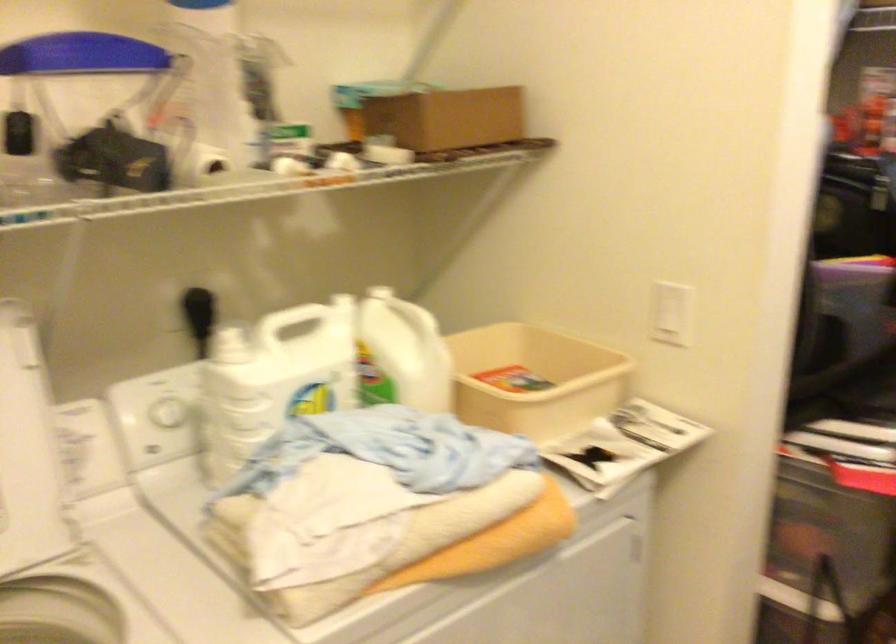
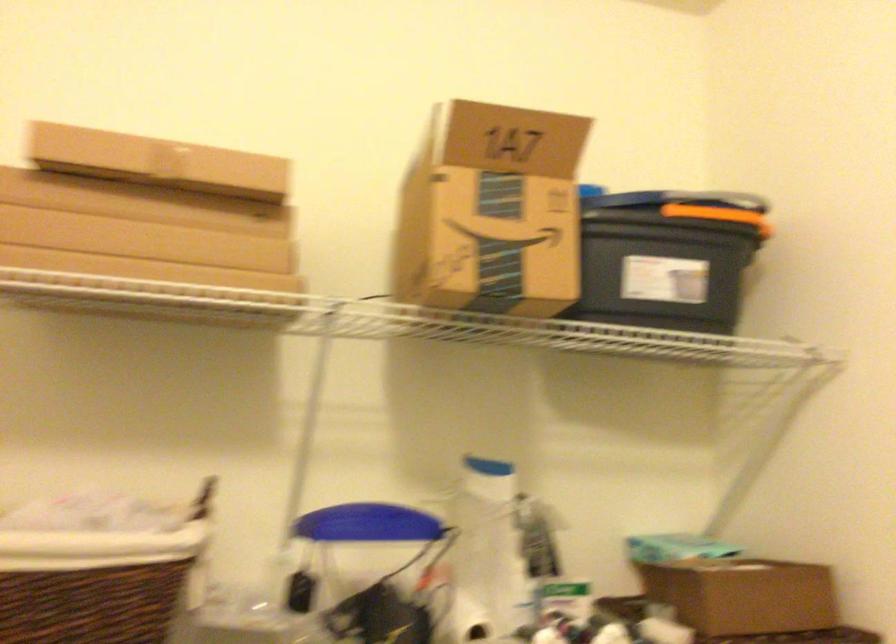
How did the camera likely rotate?

The rotation direction of the camera is left-up.